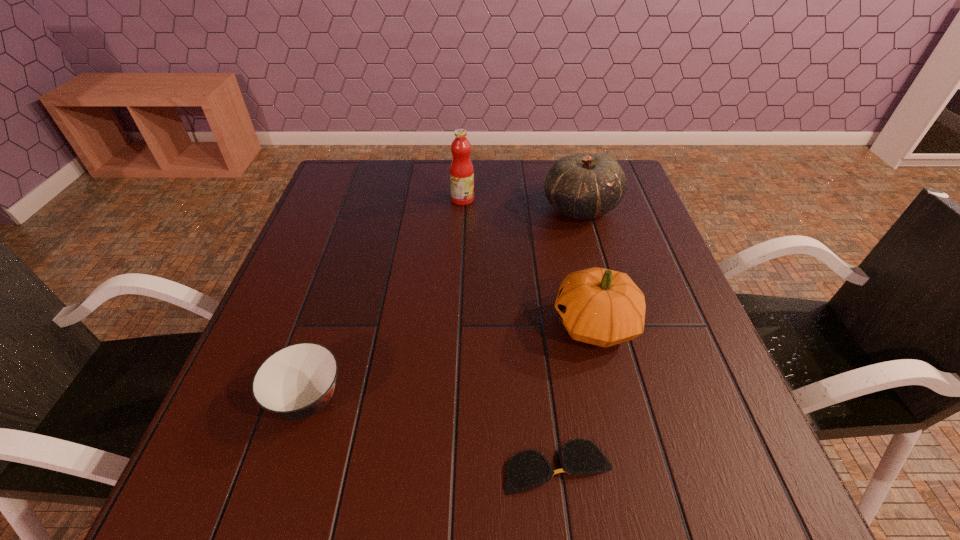
Find the location of a particular element. This screenshot has width=960, height=540. vacant area that lies between the fourth farthest object and the farther gourd is located at coordinates (444, 303).

Locate an element on the screen. free space between the third farthest object and the spectacles is located at coordinates (577, 395).

Locate an element on the screen. Image resolution: width=960 pixels, height=540 pixels. empty location between the farther gourd and the second object from left to right is located at coordinates (522, 204).

The height and width of the screenshot is (540, 960). I want to click on unoccupied position between the leftmost object and the farther gourd, so click(x=444, y=303).

At what (x,y) coordinates should I click in order to perform the action: click on free point between the fourth object from right to left and the third nearest object. Please return your answer as a coordinate pair (x, y). Looking at the image, I should click on (529, 261).

This screenshot has height=540, width=960. What are the coordinates of `object that is the third closest to the fruit juice` in the screenshot? It's located at point(297,381).

Where is `object that ranks as the fourth closest to the fourth object from right to left`? The width and height of the screenshot is (960, 540). object that ranks as the fourth closest to the fourth object from right to left is located at coordinates (527, 469).

The width and height of the screenshot is (960, 540). In order to click on vacant region that satisfies the following two spatial constraints: 1. on the side of the third nearest object with the carved face; 2. on the front side of the spectacles in this screenshot , I will do `click(630, 467)`.

Image resolution: width=960 pixels, height=540 pixels. I want to click on free spot that satisfies the following two spatial constraints: 1. on the front label of the second object from left to right; 2. on the left side of the shortest object, so (449, 467).

Where is `vacant area in the image that satisfies the following two spatial constraints: 1. on the front label of the tallest object; 2. on the front side of the soup bowl`? vacant area in the image that satisfies the following two spatial constraints: 1. on the front label of the tallest object; 2. on the front side of the soup bowl is located at coordinates (453, 400).